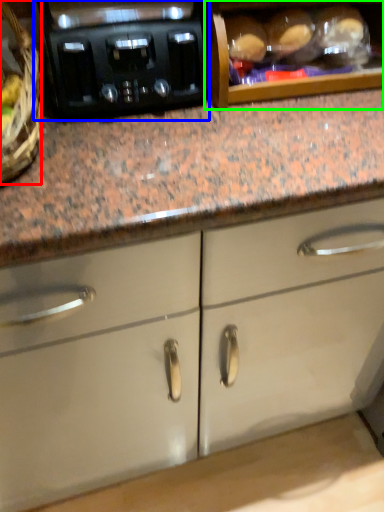
Question: Which object is positioned closest to basket (highlighted by a red box)? Select from home appliance (highlighted by a blue box) and cabinetry (highlighted by a green box).

Choices:
 (A) home appliance
 (B) cabinetry

Answer: (A)